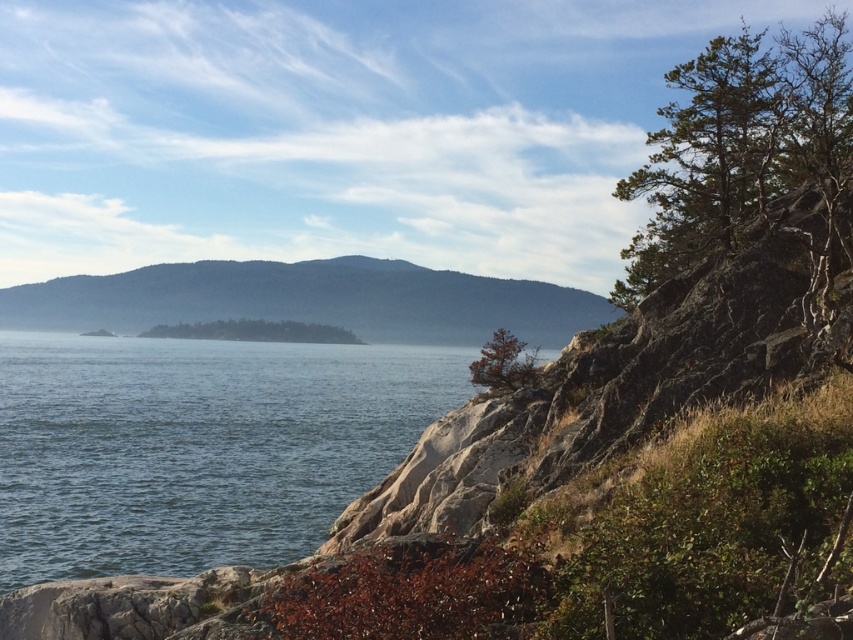
Is point (79, 317) behind point (492, 353)?

Yes.

Can you confirm if gray rocky mountain at center is positioned to the left of green matte tree at upper right?

Correct, you'll find gray rocky mountain at center to the left of green matte tree at upper right.

Between point (256, 314) and point (514, 380), which one is positioned in front?

Point (514, 380) is in front.

Locate an element on the screen. gray rocky mountain at center is located at coordinates (311, 300).

Between point (18, 305) and point (224, 323), which one is positioned behind?

Point (18, 305)

Can you confirm if gray rocky mountain at center is positioned to the right of green leafy tree at center?

No, gray rocky mountain at center is not to the right of green leafy tree at center.

Where is `gray rocky mountain at center`? The height and width of the screenshot is (640, 853). gray rocky mountain at center is located at coordinates tap(311, 300).

Is point (132, 470) positioned after point (834, 20)?

No, (132, 470) is in front of (834, 20).

Can you confirm if clear water at lower left is bigger than green textured rock at upper right?

Incorrect, clear water at lower left is not larger than green textured rock at upper right.

Who is more distant from viewer, (93,417) or (755,83)?

Point (93,417)

The height and width of the screenshot is (640, 853). Find the location of `clear water at lower left`. clear water at lower left is located at coordinates (196, 448).